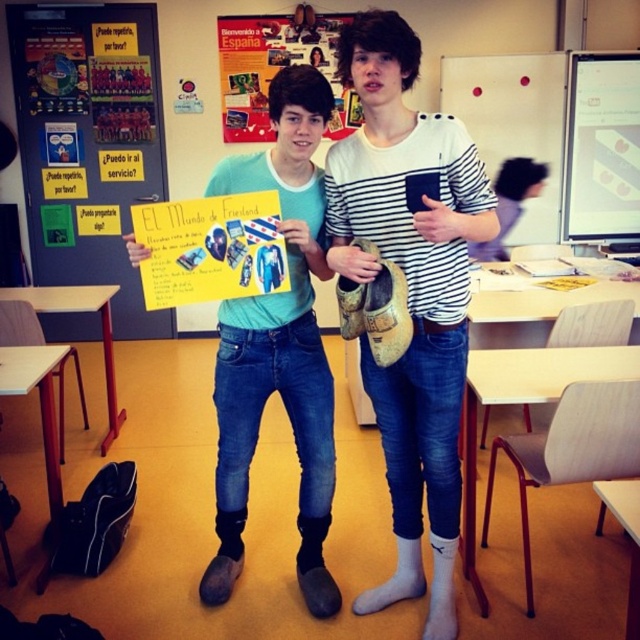
Question: Which point is closer to the camera?

Choices:
 (A) yellow paper at center
 (B) striped cotton shirt at center
 (C) matte paper poster at upper center
 (D) matte brown wooden shoes at center

Answer: (B)

Question: Which of these objects is positioned closest to the striped cotton shirt at center?

Choices:
 (A) yellow paper at center
 (B) matte paper poster at upper center
 (C) whiteboard at upper center

Answer: (A)

Question: Considering the relative positions of striped cotton shirt at center and whiteboard at upper center in the image provided, where is striped cotton shirt at center located with respect to whiteboard at upper center?

Choices:
 (A) above
 (B) below

Answer: (B)

Question: Can you confirm if striped cotton shirt at center is wider than whiteboard at upper center?

Choices:
 (A) no
 (B) yes

Answer: (A)

Question: Which of the following is the closest to the observer?

Choices:
 (A) (244, 24)
 (B) (472, 220)
 (C) (477, 81)

Answer: (B)

Question: Does striped cotton shirt at center appear on the left side of yellow paper at center?

Choices:
 (A) no
 (B) yes

Answer: (A)